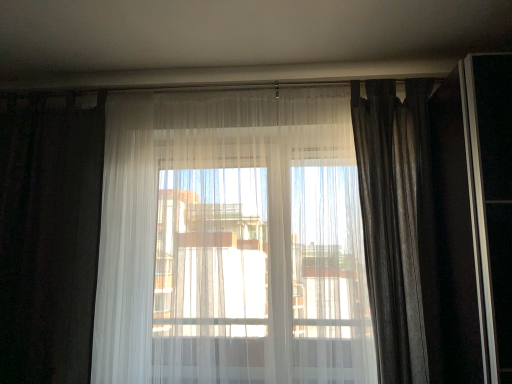
Question: Does sheer white curtain at center, which ranks as the 2th curtain in right-to-left order, have a smaller size compared to silky gray curtain at right, which is the first curtain in right-to-left order?

Choices:
 (A) yes
 (B) no

Answer: (B)

Question: Considering the relative sizes of sheer white curtain at center, the 2th curtain from the left, and silky gray curtain at right, which is the first curtain in right-to-left order, in the image provided, is sheer white curtain at center, the 2th curtain from the left, shorter than silky gray curtain at right, which is the first curtain in right-to-left order,?

Choices:
 (A) yes
 (B) no

Answer: (B)

Question: Could you tell me if sheer white curtain at center, which ranks as the 2th curtain in right-to-left order, is turned towards silky gray curtain at right, which is the first curtain in right-to-left order?

Choices:
 (A) no
 (B) yes

Answer: (A)

Question: Does sheer white curtain at center, the 2th curtain from the left, touch silky gray curtain at right, which is the first curtain in right-to-left order?

Choices:
 (A) yes
 (B) no

Answer: (B)

Question: From the image's perspective, would you say sheer white curtain at center, the 2th curtain from the left, is positioned over silky gray curtain at right, which is the first curtain in right-to-left order?

Choices:
 (A) yes
 (B) no

Answer: (B)

Question: Considering the relative sizes of sheer white curtain at center, the 2th curtain from the left, and silky gray curtain at right, which is the first curtain in right-to-left order, in the image provided, is sheer white curtain at center, the 2th curtain from the left, bigger than silky gray curtain at right, which is the first curtain in right-to-left order,?

Choices:
 (A) yes
 (B) no

Answer: (A)

Question: Can you confirm if white sheer curtain at left, the first curtain positioned from the left, is thinner than silky gray curtain at right, the 3th curtain in the left-to-right sequence?

Choices:
 (A) yes
 (B) no

Answer: (A)

Question: Is white sheer curtain at left, the 3th curtain positioned from the right, far away from silky gray curtain at right, which is the first curtain in right-to-left order?

Choices:
 (A) yes
 (B) no

Answer: (A)

Question: Can you confirm if white sheer curtain at left, the 3th curtain positioned from the right, is smaller than silky gray curtain at right, the 3th curtain in the left-to-right sequence?

Choices:
 (A) no
 (B) yes

Answer: (A)

Question: From the image's perspective, would you say white sheer curtain at left, the 3th curtain positioned from the right, is positioned over silky gray curtain at right, the 3th curtain in the left-to-right sequence?

Choices:
 (A) yes
 (B) no

Answer: (B)

Question: Is white sheer curtain at left, the 3th curtain positioned from the right, wider than silky gray curtain at right, the 3th curtain in the left-to-right sequence?

Choices:
 (A) no
 (B) yes

Answer: (A)

Question: Is white sheer curtain at left, the 3th curtain positioned from the right, further to camera compared to silky gray curtain at right, the 3th curtain in the left-to-right sequence?

Choices:
 (A) no
 (B) yes

Answer: (B)

Question: Is silky gray curtain at right, which is the first curtain in right-to-left order, outside sheer white curtain at center, the 2th curtain from the left?

Choices:
 (A) no
 (B) yes

Answer: (B)